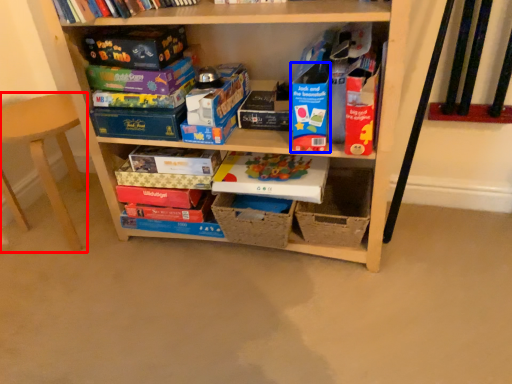
Question: Which point is further to the camera, armchair (highlighted by a red box) or paperback book (highlighted by a blue box)?

Choices:
 (A) armchair
 (B) paperback book

Answer: (A)